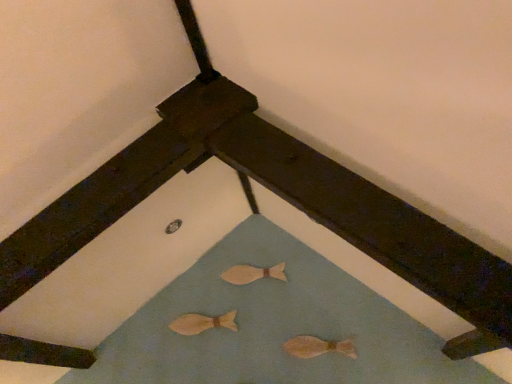
What do you see at coordinates (318, 347) in the screenshot? I see `light brown wooden fish at lower center, which is the 3th animal in left-to-right order` at bounding box center [318, 347].

What do you see at coordinates (253, 273) in the screenshot? I see `wooden fish at center, which is the 2th animal from left to right` at bounding box center [253, 273].

Image resolution: width=512 pixels, height=384 pixels. I want to click on wooden fish at center, the second animal positioned from the back, so click(x=202, y=323).

Does wooden fish at center, which is counted as the third animal, starting from the right, have a larger size compared to wooden fish at center, acting as the third animal starting from the front?

Yes.

Is wooden fish at center, the second animal positioned from the back, facing away from wooden fish at center, acting as the third animal starting from the bottom?

That's not correct — wooden fish at center, the second animal positioned from the back, is not looking away from wooden fish at center, acting as the third animal starting from the bottom.

From the image's perspective, starting from the wooden fish at center, placed as the 1th animal when sorted from top to bottom, which animal is the 1st one below? Please provide its 2D coordinates.

[(202, 323)]

Does wooden fish at center, which is counted as the third animal, starting from the right, lie in front of wooden fish at center, the 1th animal from the back?

Yes, wooden fish at center, which is counted as the third animal, starting from the right, is closer to the viewer.

Find the location of a particular element. animal that is the 2nd one above the light brown wooden fish at lower center, which appears as the first animal when ordered from the bottom (from a real-world perspective) is located at coordinates (253, 273).

Does wooden fish at center, which is the 2th animal from left to right, have a larger size compared to light brown wooden fish at lower center, which appears as the first animal when ordered from the bottom?

Actually, wooden fish at center, which is the 2th animal from left to right, might be smaller than light brown wooden fish at lower center, which appears as the first animal when ordered from the bottom.

From a real-world perspective, which object stands above the other?

In real-world perspective, wooden fish at center, which is the 2th animal from left to right, is above.

In the scene shown: Is light brown wooden fish at lower center, which is the 3th animal in left-to-right order, turned away from wooden fish at center, placed as the 1th animal when sorted from top to bottom?

No, wooden fish at center, placed as the 1th animal when sorted from top to bottom, is not at the back of light brown wooden fish at lower center, which is the 3th animal in left-to-right order.

Between light brown wooden fish at lower center, placed as the third animal when sorted from top to bottom, and wooden fish at center, placed as the 1th animal when sorted from top to bottom, which one has smaller size?

Smaller between the two is wooden fish at center, placed as the 1th animal when sorted from top to bottom.

Does light brown wooden fish at lower center, which appears as the third animal when viewed from the back, have a lesser width compared to wooden fish at center, acting as the third animal starting from the bottom?

In fact, light brown wooden fish at lower center, which appears as the third animal when viewed from the back, might be wider than wooden fish at center, acting as the third animal starting from the bottom.

Is light brown wooden fish at lower center, placed as the third animal when sorted from top to bottom, to the right of wooden fish at center, arranged as the second animal when viewed from the top, from the viewer's perspective?

Yes, light brown wooden fish at lower center, placed as the third animal when sorted from top to bottom, is to the right of wooden fish at center, arranged as the second animal when viewed from the top.

Is light brown wooden fish at lower center, which ranks as the first animal in right-to-left order, surrounding wooden fish at center, the 1th animal when ordered from left to right?

No, light brown wooden fish at lower center, which ranks as the first animal in right-to-left order, does not contain wooden fish at center, the 1th animal when ordered from left to right.

In the scene shown: Which is nearer, (301, 343) or (181, 334)?

Point (301, 343).

Is wooden fish at center, the second animal positioned from the back, oriented towards light brown wooden fish at lower center, placed as the third animal when sorted from top to bottom?

No.

Identify the location of the 2nd animal to the left when counting from the light brown wooden fish at lower center, which is counted as the 1th animal, starting from the front. Image resolution: width=512 pixels, height=384 pixels. (202, 323).

Considering the relative sizes of wooden fish at center, which is counted as the 2th animal, starting from the front, and light brown wooden fish at lower center, which appears as the third animal when viewed from the back, in the image provided, is wooden fish at center, which is counted as the 2th animal, starting from the front, wider than light brown wooden fish at lower center, which appears as the third animal when viewed from the back,?

Correct, the width of wooden fish at center, which is counted as the 2th animal, starting from the front, exceeds that of light brown wooden fish at lower center, which appears as the third animal when viewed from the back.

Is wooden fish at center, the second animal positioned from the back, to the left of light brown wooden fish at lower center, which is counted as the 1th animal, starting from the front, from the viewer's perspective?

Correct, you'll find wooden fish at center, the second animal positioned from the back, to the left of light brown wooden fish at lower center, which is counted as the 1th animal, starting from the front.

From a real-world perspective, who is located lower, wooden fish at center, the 1th animal from the back, or wooden fish at center, arranged as the second animal when viewed from the top?

In real-world perspective, wooden fish at center, arranged as the second animal when viewed from the top, is lower.

From the image's perspective, which one is positioned lower, wooden fish at center, acting as the third animal starting from the front, or wooden fish at center, which is counted as the third animal, starting from the right?

wooden fish at center, which is counted as the third animal, starting from the right, from the image's perspective.

Considering the relative positions of wooden fish at center, the 1th animal from the back, and wooden fish at center, which is counted as the third animal, starting from the right, in the image provided, is wooden fish at center, the 1th animal from the back, to the right of wooden fish at center, which is counted as the third animal, starting from the right, from the viewer's perspective?

Correct, you'll find wooden fish at center, the 1th animal from the back, to the right of wooden fish at center, which is counted as the third animal, starting from the right.

Locate an element on the screen. animal that appears above the wooden fish at center, the 2th animal positioned from the bottom (from the image's perspective) is located at coordinates (253, 273).

In order to click on animal on the right side of wooden fish at center, the 2th animal in the right-to-left sequence in this screenshot , I will do `click(318, 347)`.

Looking at this image, based on their spatial positions, is light brown wooden fish at lower center, placed as the third animal when sorted from top to bottom, or wooden fish at center, acting as the third animal starting from the front, closer to wooden fish at center, arranged as the second animal when viewed from the top?

The object closer to wooden fish at center, arranged as the second animal when viewed from the top, is wooden fish at center, acting as the third animal starting from the front.

From the image, which object appears to be nearer to wooden fish at center, acting as the third animal starting from the front, light brown wooden fish at lower center, which appears as the third animal when viewed from the back, or wooden fish at center, the second animal positioned from the back?

wooden fish at center, the second animal positioned from the back, is positioned closer to the anchor wooden fish at center, acting as the third animal starting from the front.

Looking at the image, which one is located further to wooden fish at center, which is counted as the 2th animal, starting from the front, wooden fish at center, placed as the 1th animal when sorted from top to bottom, or light brown wooden fish at lower center, which appears as the first animal when ordered from the bottom?

Based on the image, light brown wooden fish at lower center, which appears as the first animal when ordered from the bottom, appears to be further to wooden fish at center, which is counted as the 2th animal, starting from the front.

From the image, which object appears to be nearer to light brown wooden fish at lower center, which ranks as the first animal in right-to-left order, wooden fish at center, which is counted as the 2th animal, starting from the front, or wooden fish at center, placed as the 1th animal when sorted from top to bottom?

wooden fish at center, placed as the 1th animal when sorted from top to bottom, is closer to light brown wooden fish at lower center, which ranks as the first animal in right-to-left order.

In the scene shown: From the image, which object appears to be nearer to light brown wooden fish at lower center, which is the 3th animal in left-to-right order, wooden fish at center, the 2th animal in the right-to-left sequence, or wooden fish at center, the 2th animal positioned from the bottom?

wooden fish at center, the 2th animal in the right-to-left sequence.

Based on their spatial positions, is wooden fish at center, which is counted as the 2th animal, starting from the front, or light brown wooden fish at lower center, which is counted as the 1th animal, starting from the front, closer to wooden fish at center, placed as the 1th animal when sorted from top to bottom?

Among the two, wooden fish at center, which is counted as the 2th animal, starting from the front, is located nearer to wooden fish at center, placed as the 1th animal when sorted from top to bottom.

Find the location of `animal between wooden fish at center, arranged as the second animal when viewed from the top, and light brown wooden fish at lower center, which appears as the third animal when viewed from the back`. animal between wooden fish at center, arranged as the second animal when viewed from the top, and light brown wooden fish at lower center, which appears as the third animal when viewed from the back is located at coordinates (253, 273).